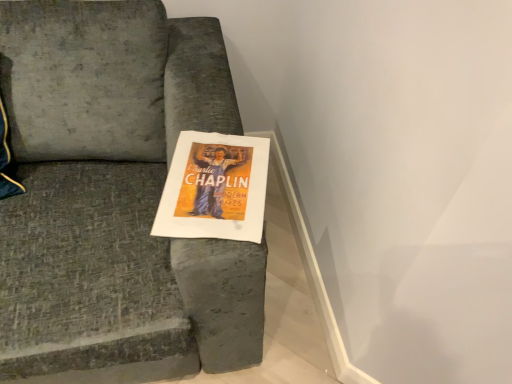
This screenshot has width=512, height=384. What do you see at coordinates (215, 188) in the screenshot?
I see `matte paper poster at center` at bounding box center [215, 188].

The image size is (512, 384). Find the location of `matte paper poster at center`. matte paper poster at center is located at coordinates (215, 188).

Locate an element on the screen. velvet gray couch at center is located at coordinates (115, 197).

This screenshot has height=384, width=512. What do you see at coordinates (115, 197) in the screenshot? I see `velvet gray couch at center` at bounding box center [115, 197].

Find the location of a particular element. matte paper poster at center is located at coordinates (215, 188).

Considering the positions of objects velvet gray couch at center and matte paper poster at center in the image provided, who is more to the left, velvet gray couch at center or matte paper poster at center?

velvet gray couch at center is more to the left.

Does velvet gray couch at center lie behind matte paper poster at center?

No, it is in front of matte paper poster at center.

Is point (133, 137) closer or farther from the camera than point (257, 218)?

Point (133, 137) appears to be farther away from the viewer than point (257, 218).

Looking at this image, from the image's perspective, is velvet gray couch at center located beneath matte paper poster at center?

Actually, velvet gray couch at center appears above matte paper poster at center in the image.

From a real-world perspective, which object rests below the other?

velvet gray couch at center is physically lower.

Can you confirm if velvet gray couch at center is wider than matte paper poster at center?

Yes, velvet gray couch at center is wider than matte paper poster at center.

Considering the relative sizes of velvet gray couch at center and matte paper poster at center in the image provided, is velvet gray couch at center taller than matte paper poster at center?

Indeed, velvet gray couch at center has a greater height compared to matte paper poster at center.

Which of these two, velvet gray couch at center or matte paper poster at center, is bigger?

Bigger between the two is velvet gray couch at center.

Could matte paper poster at center be considered to be inside velvet gray couch at center?

Yes, matte paper poster at center is a part of velvet gray couch at center.

Is velvet gray couch at center positioned far away from matte paper poster at center?

No.

Is velvet gray couch at center oriented away from matte paper poster at center?

No, matte paper poster at center is not at the back of velvet gray couch at center.

What's the angular difference between velvet gray couch at center and matte paper poster at center's facing directions?

The facing directions of velvet gray couch at center and matte paper poster at center are 14 degrees apart.

This screenshot has width=512, height=384. Find the location of `flyer that is above the velvet gray couch at center (from a real-world perspective)`. flyer that is above the velvet gray couch at center (from a real-world perspective) is located at coordinates (215, 188).

Based on their positions, is matte paper poster at center located to the left or right of velvet gray couch at center?

matte paper poster at center is to the right of velvet gray couch at center.

Which object is further away from the camera, matte paper poster at center or velvet gray couch at center?

matte paper poster at center is behind.

Is point (224, 146) closer to viewer compared to point (193, 314)?

No, it is behind (193, 314).

From the image's perspective, between matte paper poster at center and velvet gray couch at center, which one is located above?

velvet gray couch at center, from the image's perspective.

From a real-world perspective, is matte paper poster at center located higher than velvet gray couch at center?

Yes, from a real-world perspective, matte paper poster at center is on top of velvet gray couch at center.

Can you confirm if matte paper poster at center is wider than velvet gray couch at center?

Incorrect, the width of matte paper poster at center does not surpass that of velvet gray couch at center.

Does matte paper poster at center have a lesser height compared to velvet gray couch at center?

Yes.

Is matte paper poster at center smaller than velvet gray couch at center?

Yes, matte paper poster at center is smaller than velvet gray couch at center.

Does matte paper poster at center contain velvet gray couch at center?

No, velvet gray couch at center is located outside of matte paper poster at center.

Is matte paper poster at center beside velvet gray couch at center?

They are not placed beside each other.

Is matte paper poster at center facing away from velvet gray couch at center?

Yes, matte paper poster at center's orientation is away from velvet gray couch at center.

What's the angular difference between matte paper poster at center and velvet gray couch at center's facing directions?

14 degrees.

This screenshot has width=512, height=384. In order to click on flyer that appears above the velvet gray couch at center (from a real-world perspective) in this screenshot , I will do `click(215, 188)`.

Locate an element on the screen. This screenshot has height=384, width=512. flyer on the right of velvet gray couch at center is located at coordinates (215, 188).

Where is `chair below the matte paper poster at center (from a real-world perspective)`? This screenshot has width=512, height=384. chair below the matte paper poster at center (from a real-world perspective) is located at coordinates (115, 197).